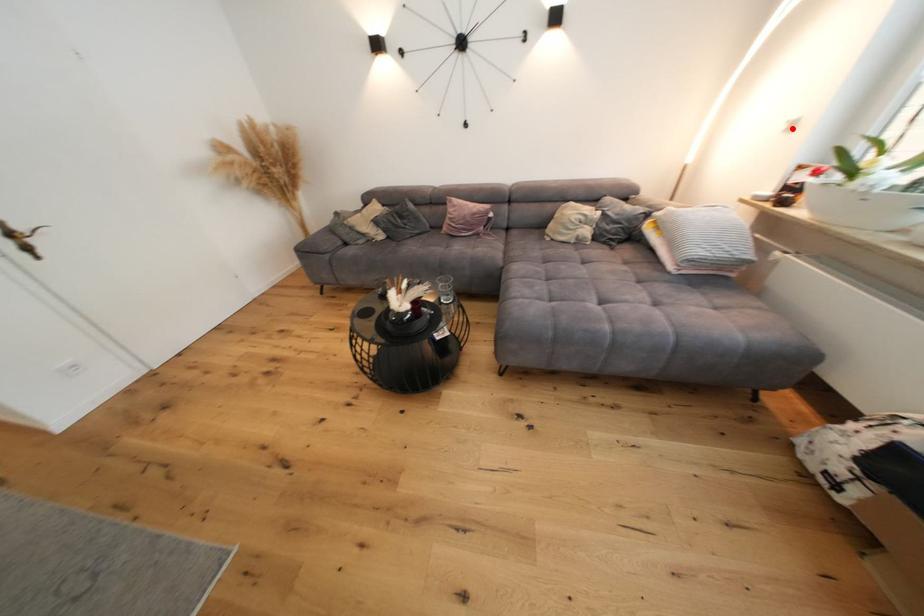
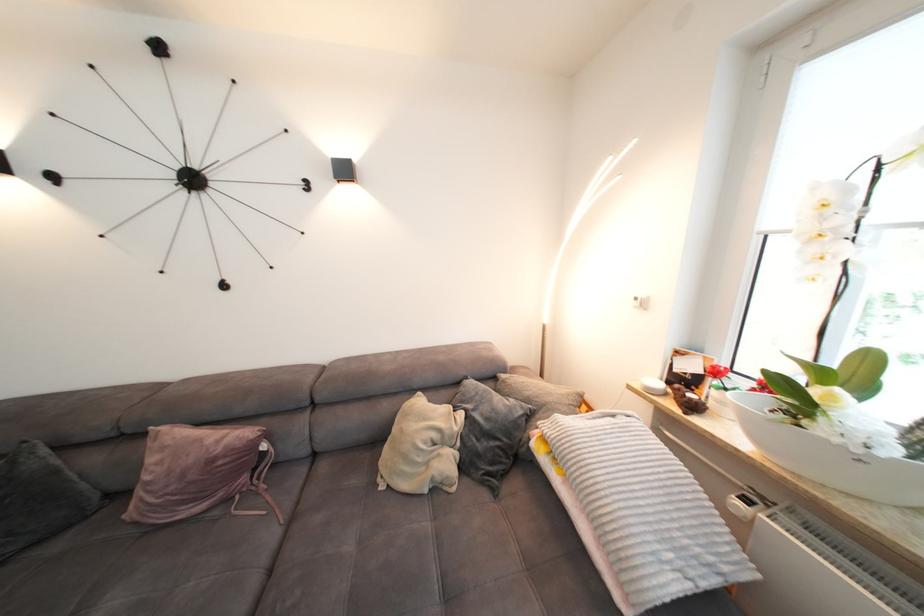
Locate, in the second image, the point that corresponds to the highlighted location in the first image.

(643, 305)